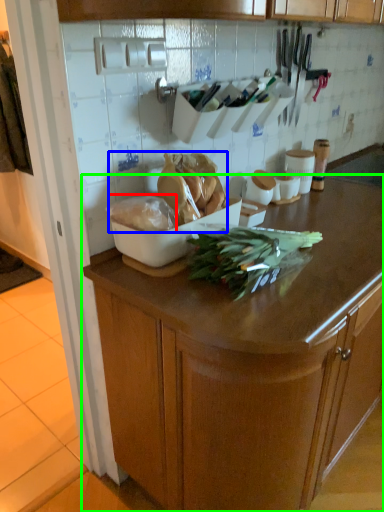
Question: Considering the real-world distances, which object is farthest from food (highlighted by a red box)? food (highlighted by a blue box) or cabinetry (highlighted by a green box)?

Choices:
 (A) food
 (B) cabinetry

Answer: (B)